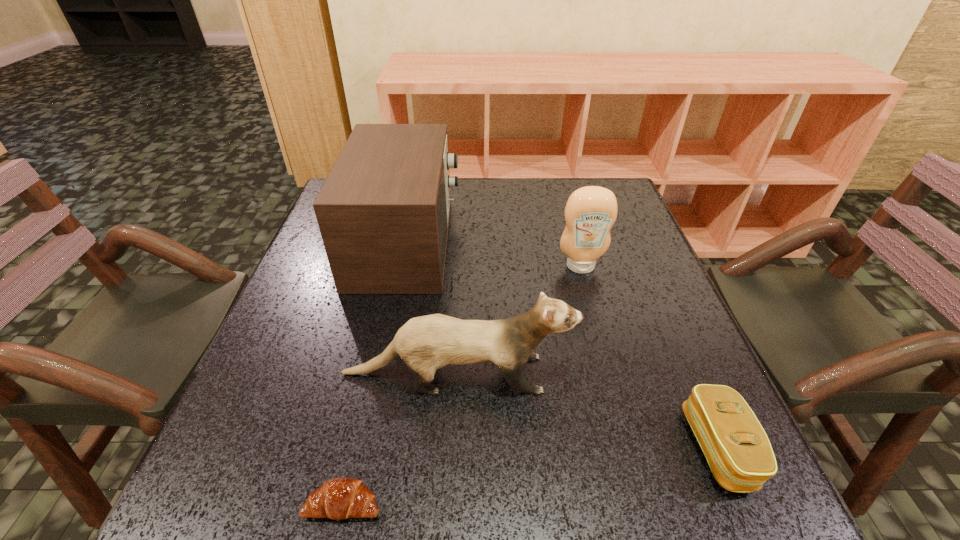
Find the location of `radio receiver`. radio receiver is located at coordinates (383, 212).

Identify the location of condiment. Image resolution: width=960 pixels, height=540 pixels. [590, 212].

The height and width of the screenshot is (540, 960). Identify the location of ferret. (426, 343).

At what (x,y) coordinates should I click in order to perform the action: click on clutch bag. Please return your answer as a coordinate pair (x, y). Looking at the image, I should click on (738, 451).

Locate an element on the screen. The image size is (960, 540). the second shortest object is located at coordinates (738, 451).

Where is `the shortest object`? The height and width of the screenshot is (540, 960). the shortest object is located at coordinates (340, 498).

In order to click on vacant area located 0.050m on the front-facing side of the radio receiver in this screenshot , I will do `click(477, 242)`.

The width and height of the screenshot is (960, 540). I want to click on vacant area located on the label of the condiment, so click(608, 366).

Find the location of a particular element. vacant space located 0.140m on the face of the third nearest object is located at coordinates (647, 374).

This screenshot has height=540, width=960. In order to click on vacant space situated 0.060m on the zipper side of the clutch bag in this screenshot , I will do `click(654, 448)`.